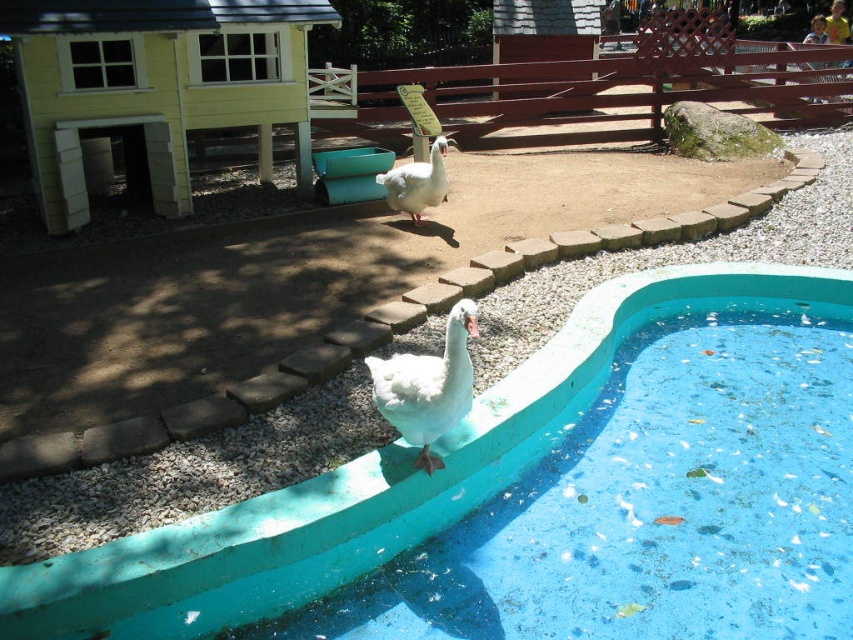
You are a zookeeper trying to locate the white matte duck at upper center. From the entrance of the enclosure, which side of the blue rubber swimming pool at center should you look behind to find the duck?

The white matte duck at upper center is behind the blue rubber swimming pool at center, so you should look behind the pool on its back side to find the duck.